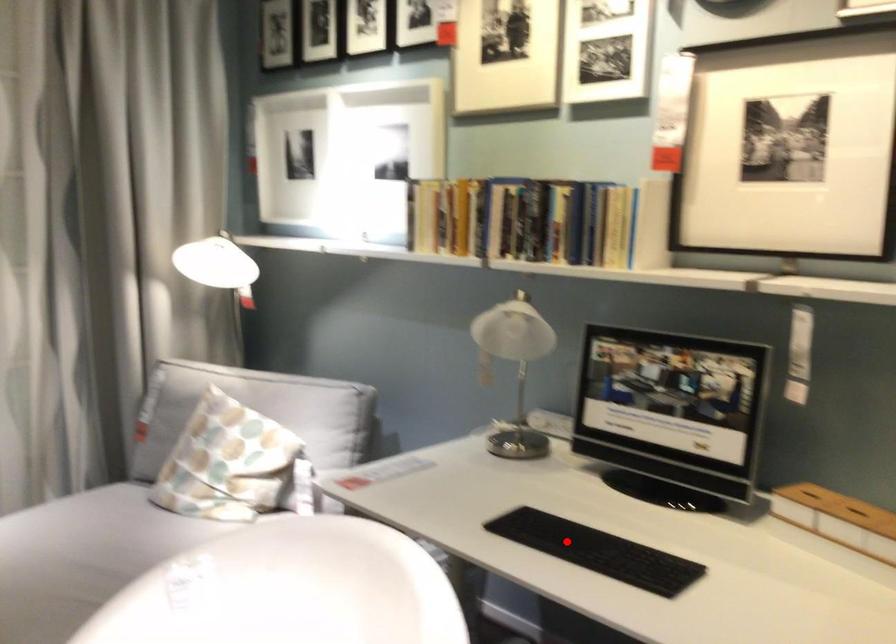
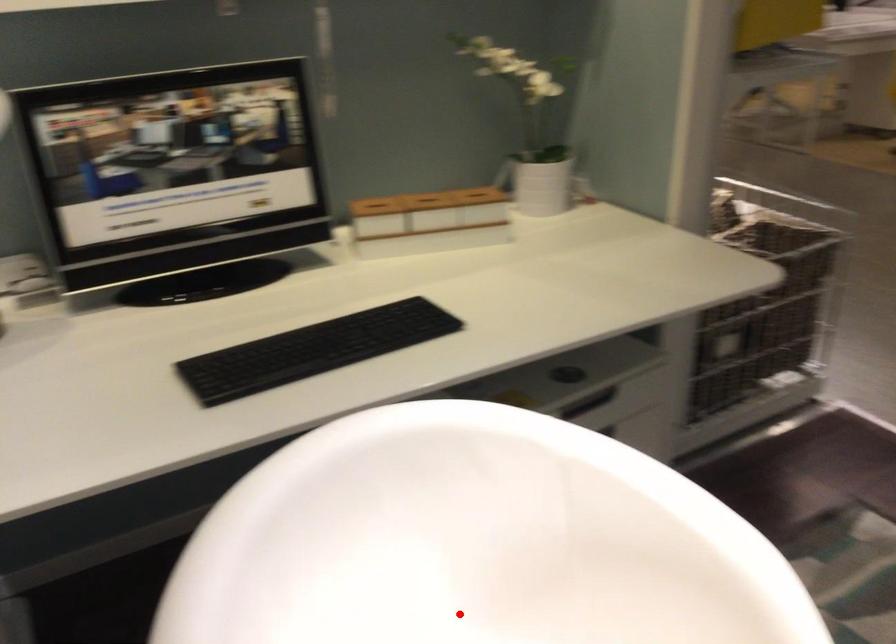
I am providing you with two images of the same scene from different viewpoints. A red point is marked on the first image and another point is marked on the second image. Is the red point in image1 aligned with the point shown in image2?

No